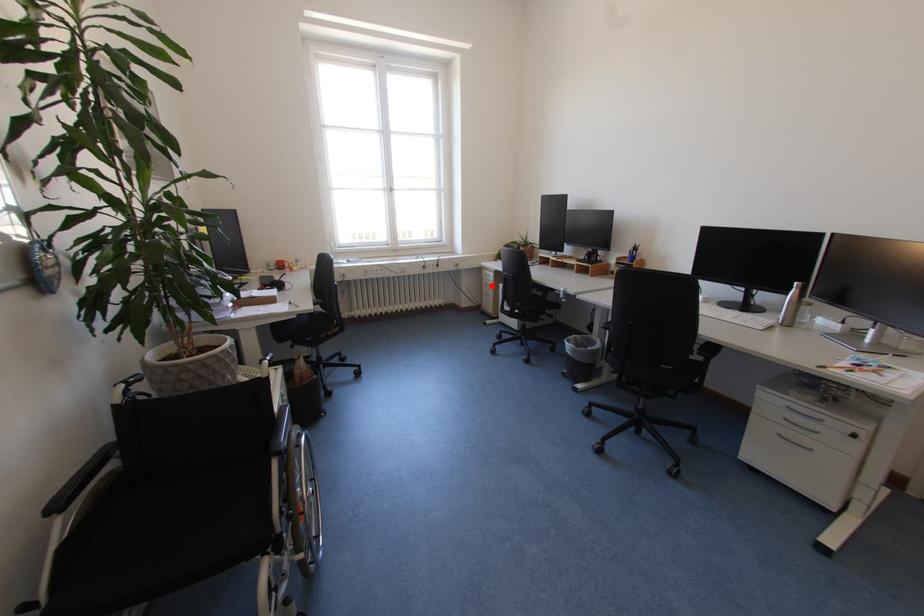
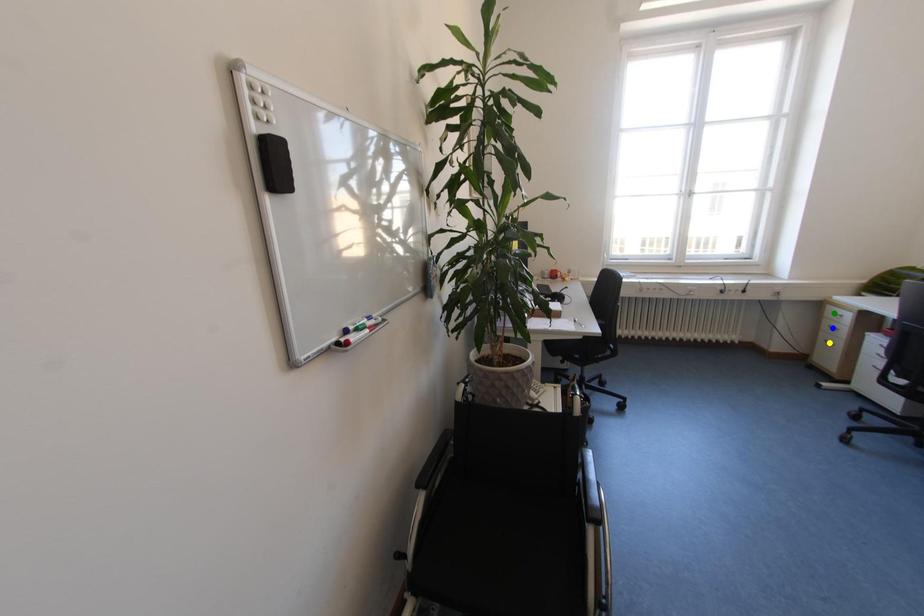
Question: I am providing you with two images of the same scene from different viewpoints. A red point is marked on the first image. You are given multiple points on the second image. Which point in image 2 is actually the same real-world point as the red point in image 1?

Choices:
 (A) green point
 (B) yellow point
 (C) blue point

Answer: (C)